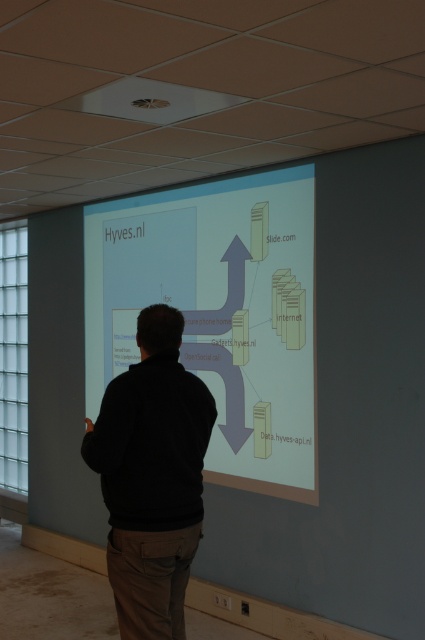
You are an attendee at the presentation and need to take a photo of the matte white projector screen at center for your notes. Where should you position yourself relative to the screen to ensure the entire screen is in frame?

Since the matte white projector screen at center is located at point [218,312], you should position yourself directly in front of the screen at its central point to capture the entire screen in your photo.